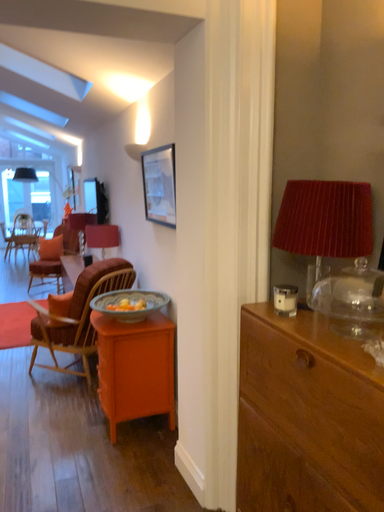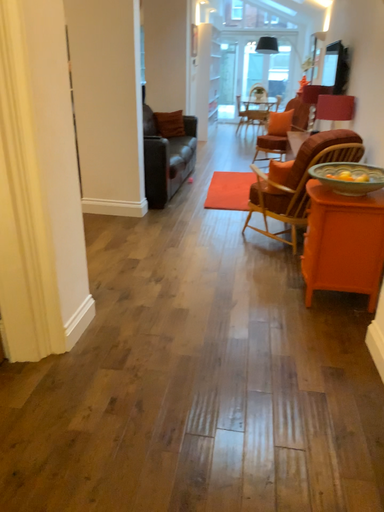
Question: Which way did the camera rotate in the video?

Choices:
 (A) rotated upward
 (B) rotated downward

Answer: (B)